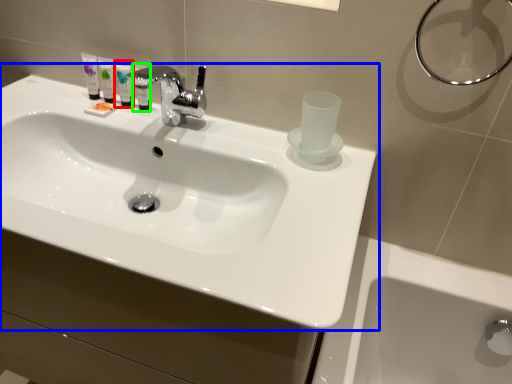
Question: Based on their relative distances, which object is nearer to mouthwash (highlighted by a red box)? Choose from sink (highlighted by a blue box) and mouthwash (highlighted by a green box).

Choices:
 (A) sink
 (B) mouthwash

Answer: (B)